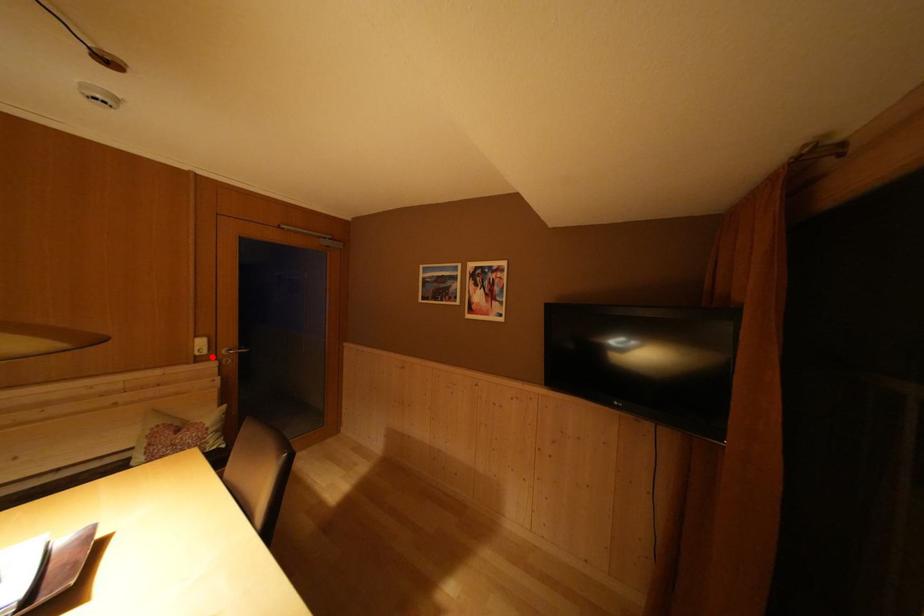
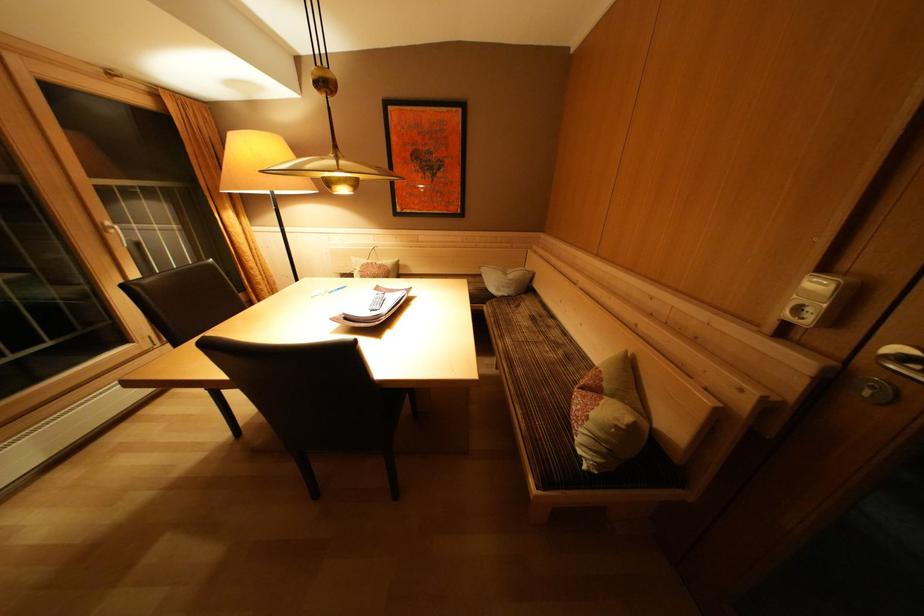
In the second image, find the point that corresponds to the highlighted location in the first image.

(815, 326)